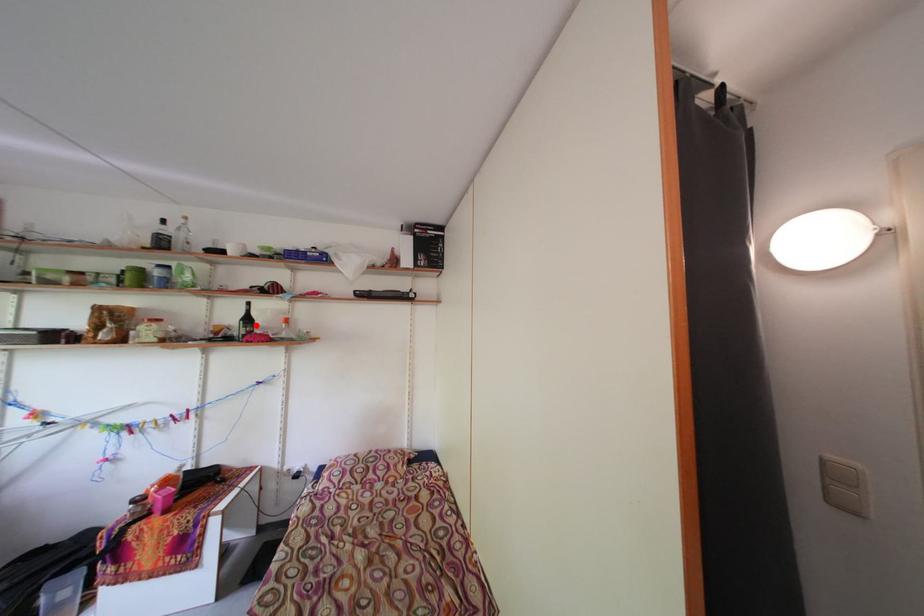
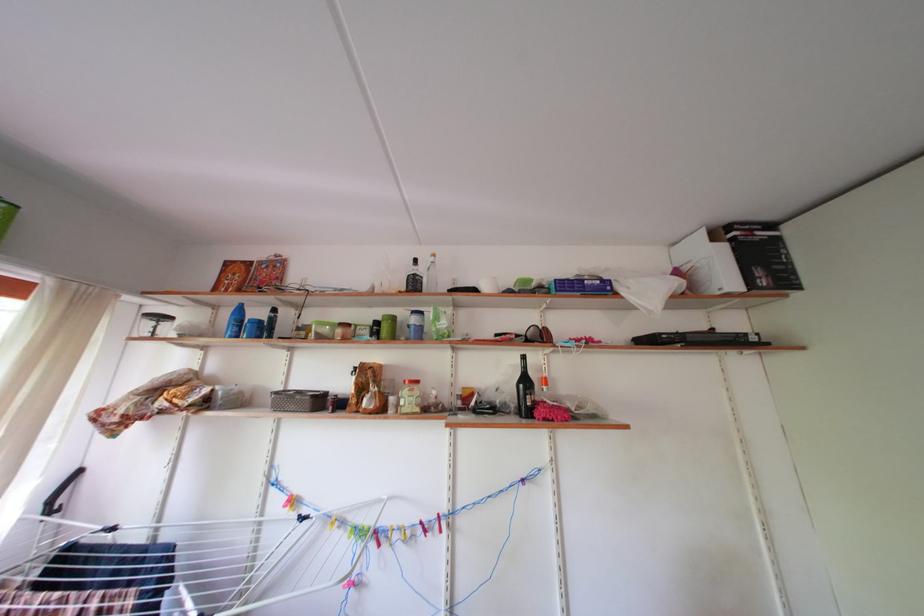
Where in the second image is the point corresponding to the highlighted location from the first image?

(533, 387)